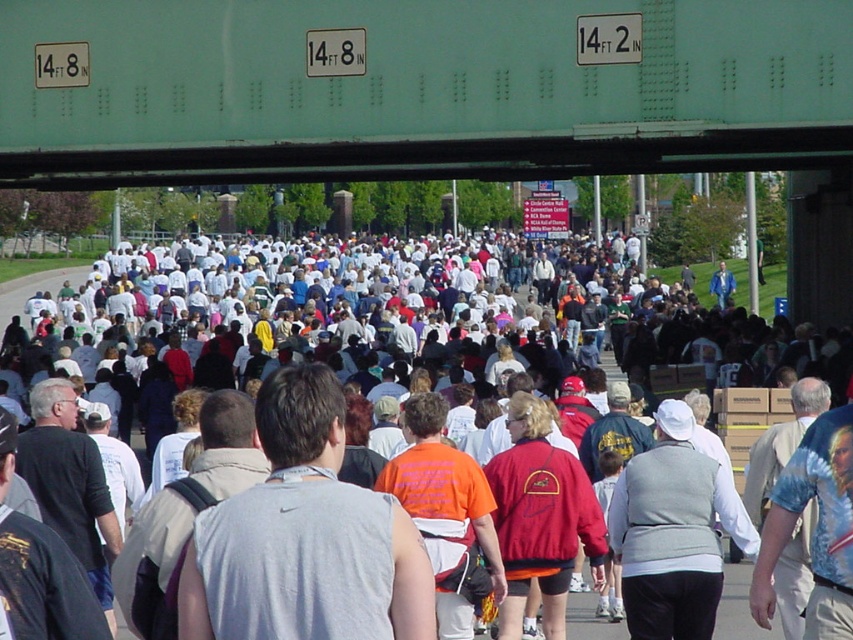
Question: Among these objects, which one is farthest from the camera?

Choices:
 (A) teal metal bridge at upper center
 (B) white cotton crowd at center
 (C) gray sleeveless shirt at center

Answer: (A)

Question: Does teal metal bridge at upper center lie in front of gray sleeveless shirt at center?

Choices:
 (A) yes
 (B) no

Answer: (B)

Question: Which object is the farthest from the white cotton crowd at center?

Choices:
 (A) teal metal bridge at upper center
 (B) gray sleeveless shirt at center

Answer: (B)

Question: Is teal metal bridge at upper center below gray sleeveless shirt at center?

Choices:
 (A) no
 (B) yes

Answer: (A)

Question: Based on their relative distances, which object is nearer to the white cotton crowd at center?

Choices:
 (A) gray sleeveless shirt at center
 (B) teal metal bridge at upper center

Answer: (B)

Question: Can you confirm if white cotton crowd at center is thinner than gray sleeveless shirt at center?

Choices:
 (A) no
 (B) yes

Answer: (A)